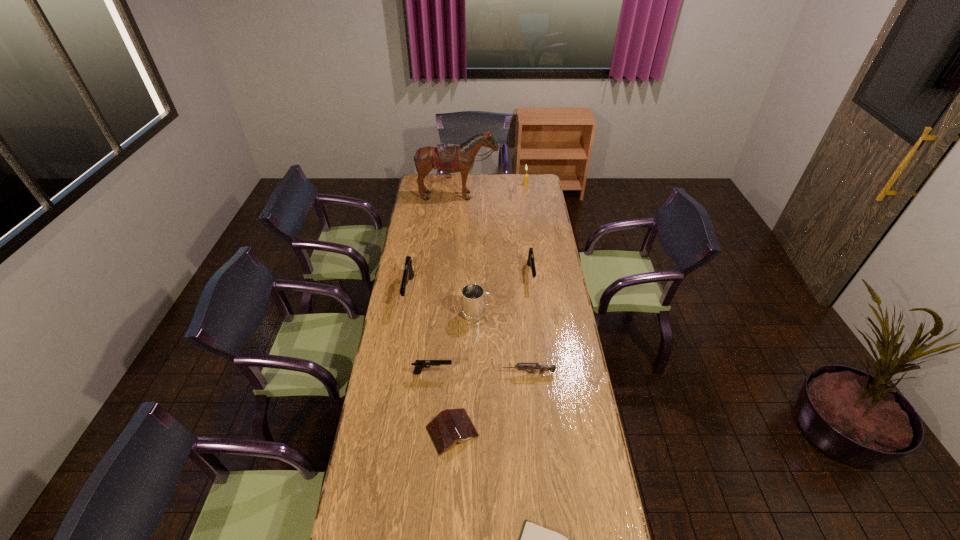
Find the location of a particular element. The width and height of the screenshot is (960, 540). free space located 0.090m at the aiming end of the smallest black gun is located at coordinates (474, 373).

Find the location of a particular element. This screenshot has width=960, height=540. free space located 0.220m aimed along the barrel of the shortest gun is located at coordinates (x=448, y=373).

Image resolution: width=960 pixels, height=540 pixels. Identify the location of free space located 0.280m aimed along the barrel of the shortest gun. (433, 373).

Find the location of a particular element. The height and width of the screenshot is (540, 960). vacant position located aimed along the barrel of the shortest gun is located at coordinates (480, 373).

I want to click on free point located on the right of the brown book, so click(x=553, y=431).

Identify the location of saddle present at the far edge. This screenshot has height=540, width=960. (451, 159).

You are a GUI agent. You are given a task and a screenshot of the screen. Output one action in this format:
    pyautogui.click(x=<x>, y=<y>)
    Task: Click on the candle situated at the far edge
    The height and width of the screenshot is (540, 960).
    Given the screenshot: What is the action you would take?
    tap(525, 183)

I want to click on saddle at the left edge, so (451, 159).

Where is `candle that is at the right edge`? candle that is at the right edge is located at coordinates (525, 183).

The width and height of the screenshot is (960, 540). What are the coordinates of `object positioned at the far left corner` in the screenshot? It's located at (451, 159).